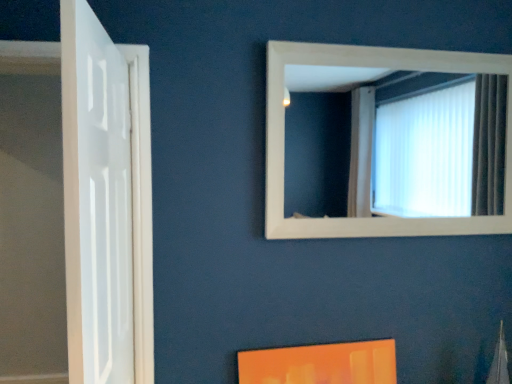
Question: From a real-world perspective, relative to white wooden frame at upper center, is white glossy door at left vertically above or below?

Choices:
 (A) below
 (B) above

Answer: (A)

Question: Is point (106, 248) closer or farther from the camera than point (425, 59)?

Choices:
 (A) farther
 (B) closer

Answer: (B)

Question: Relative to white wooden frame at upper center, is white glossy door at left in front or behind?

Choices:
 (A) front
 (B) behind

Answer: (A)

Question: Is white wooden frame at upper center in front of or behind white glossy door at left in the image?

Choices:
 (A) behind
 (B) front

Answer: (A)

Question: Is white wooden frame at upper center inside or outside of white glossy door at left?

Choices:
 (A) inside
 (B) outside

Answer: (B)

Question: In terms of height, does white wooden frame at upper center look taller or shorter compared to white glossy door at left?

Choices:
 (A) tall
 (B) short

Answer: (B)

Question: From a real-world perspective, is white wooden frame at upper center positioned above or below white glossy door at left?

Choices:
 (A) below
 (B) above

Answer: (B)